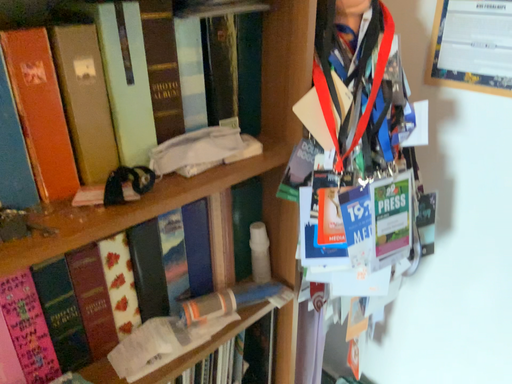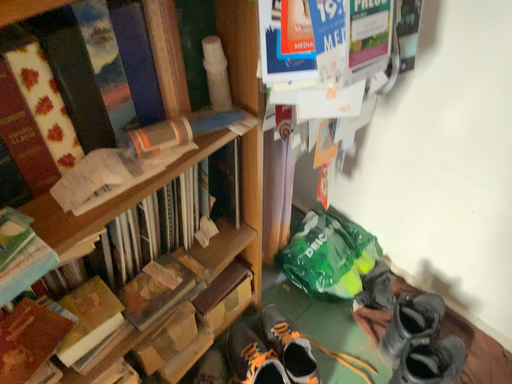
Question: Which way did the camera rotate in the video?

Choices:
 (A) rotated downward
 (B) rotated upward

Answer: (A)